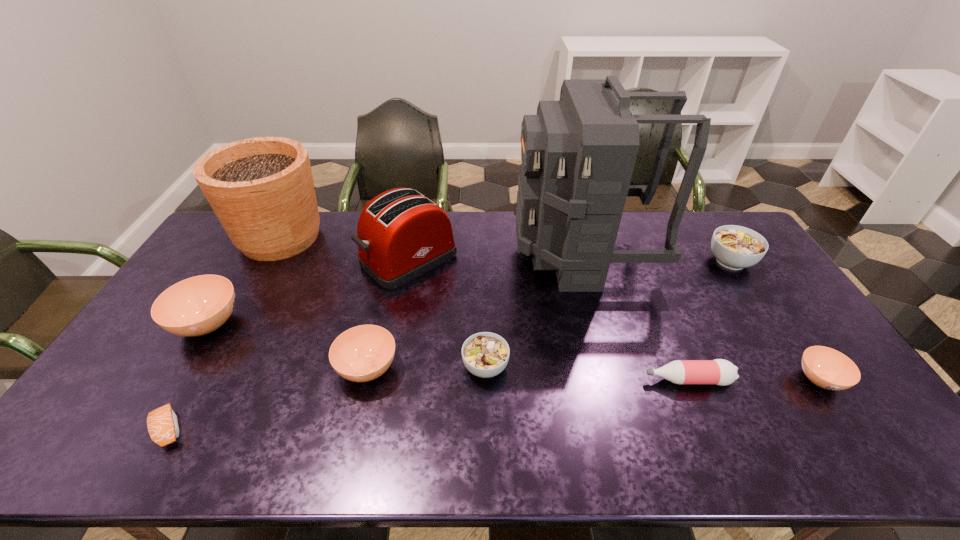
Find the location of `free spot located 0.150m on the left of the smallest peach soup bowl`. free spot located 0.150m on the left of the smallest peach soup bowl is located at coordinates (739, 380).

I want to click on free space located on the right of the nearest object, so click(267, 429).

Where is `backpack that is at the far edge`? backpack that is at the far edge is located at coordinates (578, 154).

Identify the location of flowerpot located at the far edge. The image size is (960, 540). (261, 189).

This screenshot has width=960, height=540. Find the location of `toaster present at the far edge`. toaster present at the far edge is located at coordinates (401, 234).

Find the location of a particular element. Image resolution: width=960 pixels, height=540 pixels. soup bowl located in the far edge section of the desktop is located at coordinates click(x=735, y=247).

Where is `object located in the near edge section of the desktop`? This screenshot has width=960, height=540. object located in the near edge section of the desktop is located at coordinates (162, 423).

Locate an element on the screen. flowerpot located at the left edge is located at coordinates (261, 189).

In order to click on soup bowl situated at the left edge in this screenshot , I will do `click(199, 305)`.

Where is `object present at the far left corner`? object present at the far left corner is located at coordinates (261, 189).